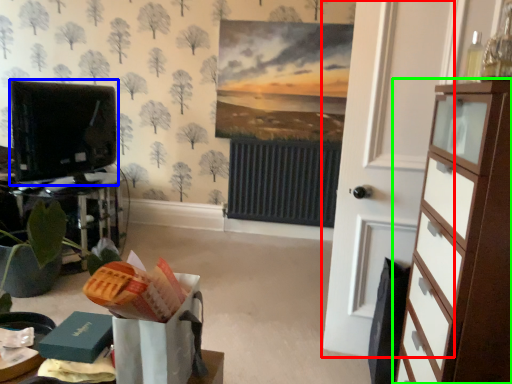
Question: Estimate the real-world distances between objects in this image. Which object is closer to door (highlighted by a red box), electronic (highlighted by a blue box) or chest of drawers (highlighted by a green box)?

Choices:
 (A) electronic
 (B) chest of drawers

Answer: (B)